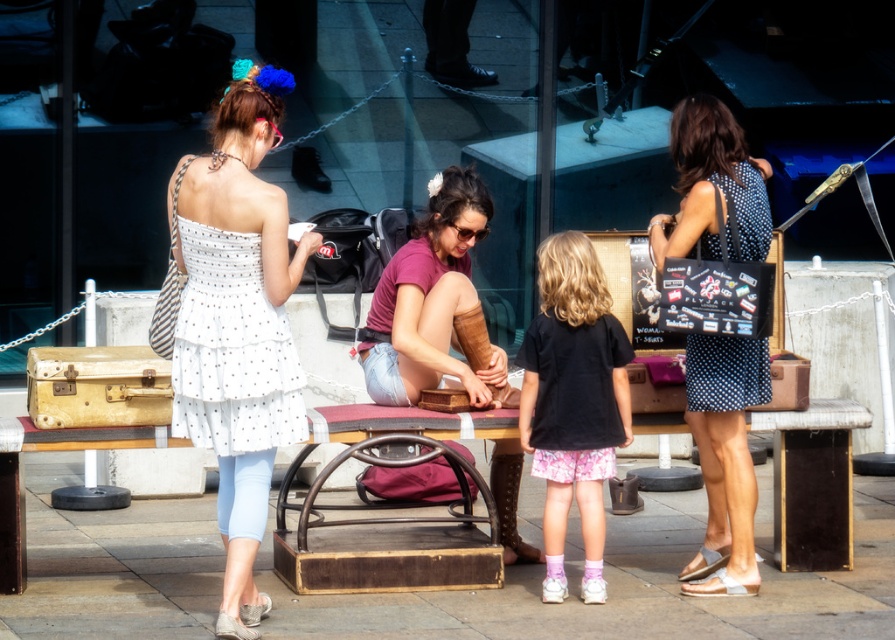
Question: Which of the following is the farthest from the observer?

Choices:
 (A) (723, 584)
 (B) (273, 426)
 (C) (678, 579)
 (D) (565, 355)

Answer: (C)

Question: Does wooden bench at center have a greater width compared to black matte shirt at center?

Choices:
 (A) yes
 (B) no

Answer: (A)

Question: Does white dotted dress at center appear over polka dot dress at right?

Choices:
 (A) yes
 (B) no

Answer: (A)

Question: Does polka dot dress at right appear under silver metallic sandal at lower left?

Choices:
 (A) yes
 (B) no

Answer: (B)

Question: Which point is farther to the camera?

Choices:
 (A) silver metallic sandal at lower left
 (B) wooden bench at center
 (C) white leather sandal at lower right

Answer: (C)

Question: Estimate the real-world distances between objects in this image. Which object is farther from the silver metallic sandal at lower left?

Choices:
 (A) polka dot dress at right
 (B) shiny gold sandal at lower right

Answer: (A)